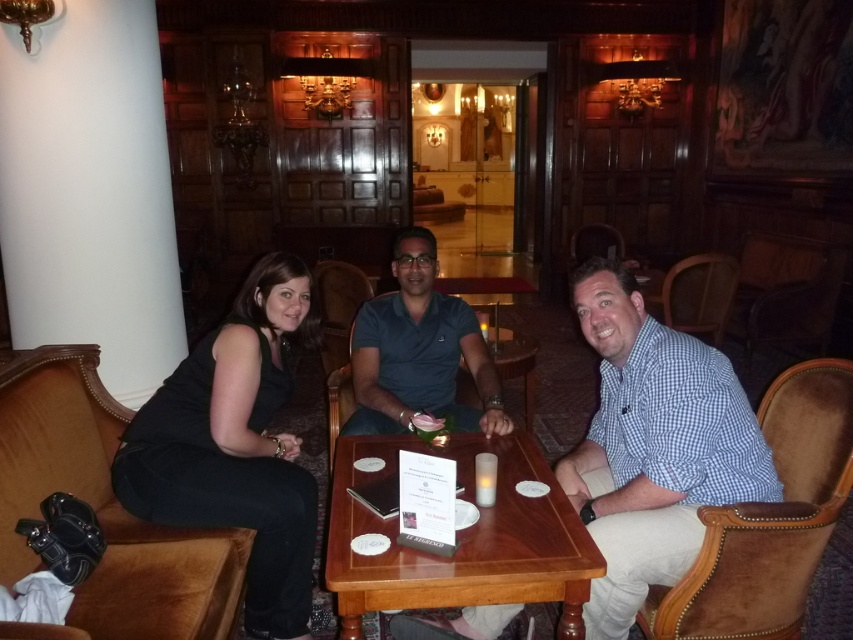
Is black fabric dress at left taller than wooden table at center?

Yes, black fabric dress at left is taller than wooden table at center.

Between point (233, 440) and point (374, 570), which one is positioned behind?

The point (233, 440) is behind.

This screenshot has width=853, height=640. In order to click on black fabric dress at left in this screenshot , I will do `click(235, 445)`.

Is point (727, 461) closer to camera compared to point (386, 598)?

That is False.

Does blue checkered shirt at center lie in front of wooden table at center?

No, it is behind wooden table at center.

Does point (612, 344) come farther from viewer compared to point (405, 572)?

Yes, point (612, 344) is behind point (405, 572).

Identify the location of blue checkered shirt at center. This screenshot has height=640, width=853. (654, 444).

Is blue checkered shirt at center to the right of blue cotton polo shirt at center from the viewer's perspective?

Yes, blue checkered shirt at center is to the right of blue cotton polo shirt at center.

Does point (722, 460) come in front of point (397, 413)?

Yes, point (722, 460) is in front of point (397, 413).

Does point (720, 468) lie behind point (445, 349)?

That is False.

The image size is (853, 640). I want to click on blue checkered shirt at center, so click(x=654, y=444).